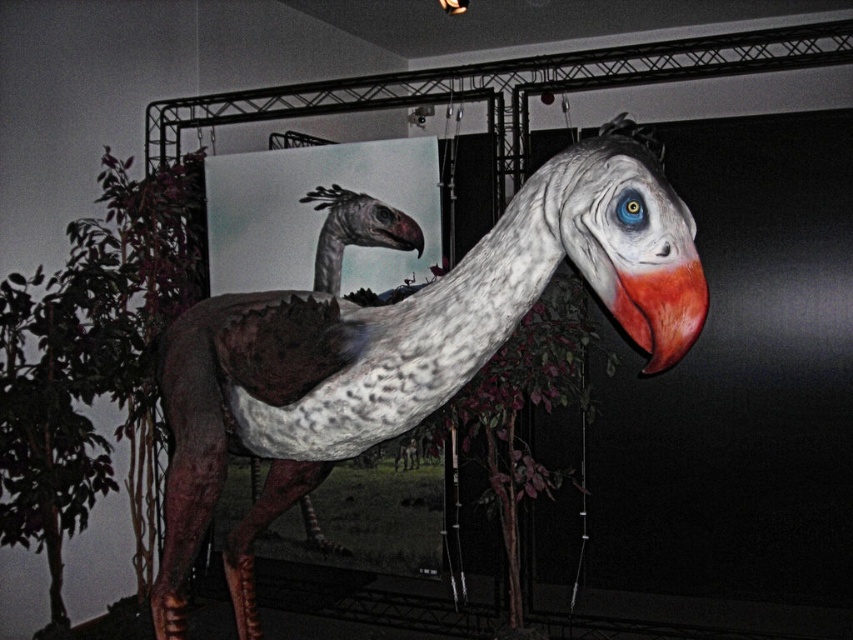
You are standing in front of the dinosaur model and want to locate the shiny red beak at center. Where exactly is it positioned in terms of coordinates?

The shiny red beak at center is positioned at coordinates point (660, 310).

You are an animal researcher observing the scene. Which object is wider, the speckled feathered ostrich at center or the shiny red beak at center?

The speckled feathered ostrich at center is wider than the shiny red beak at center according to the description.